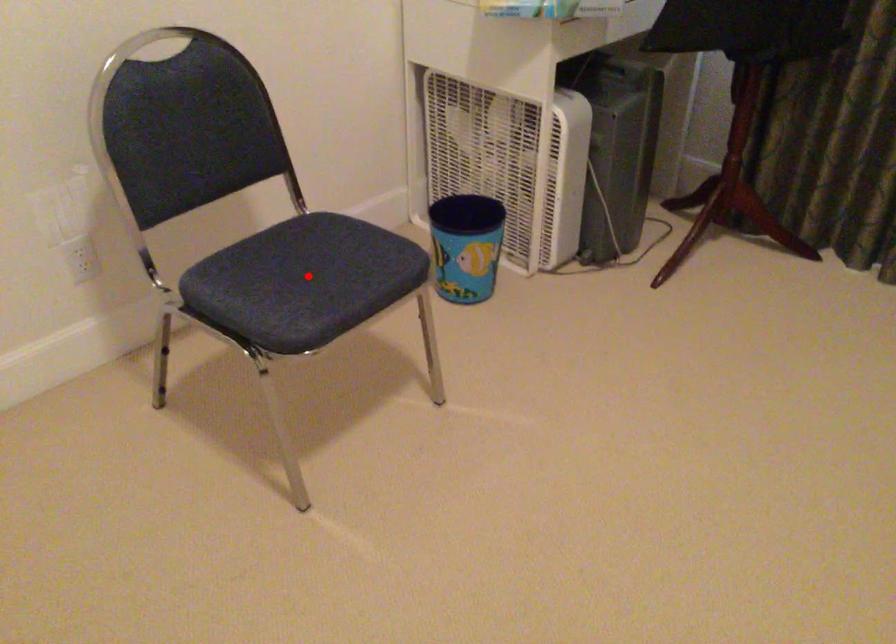
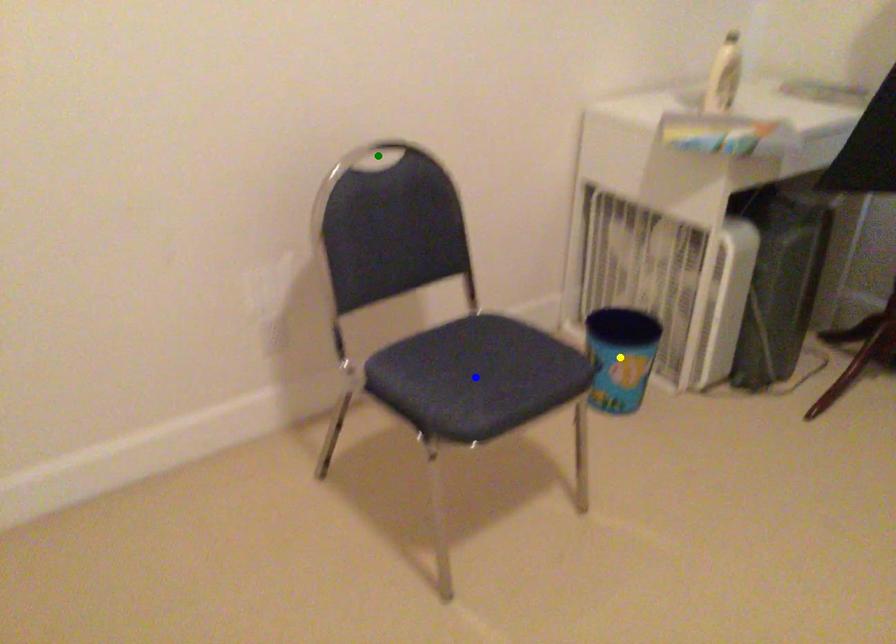
Question: I am providing you with two images of the same scene from different viewpoints. A red point is marked on the first image. You are given multiple points on the second image. Can you choose the point in image 2 that corresponds to the point in image 1?

Choices:
 (A) green point
 (B) yellow point
 (C) blue point

Answer: (C)